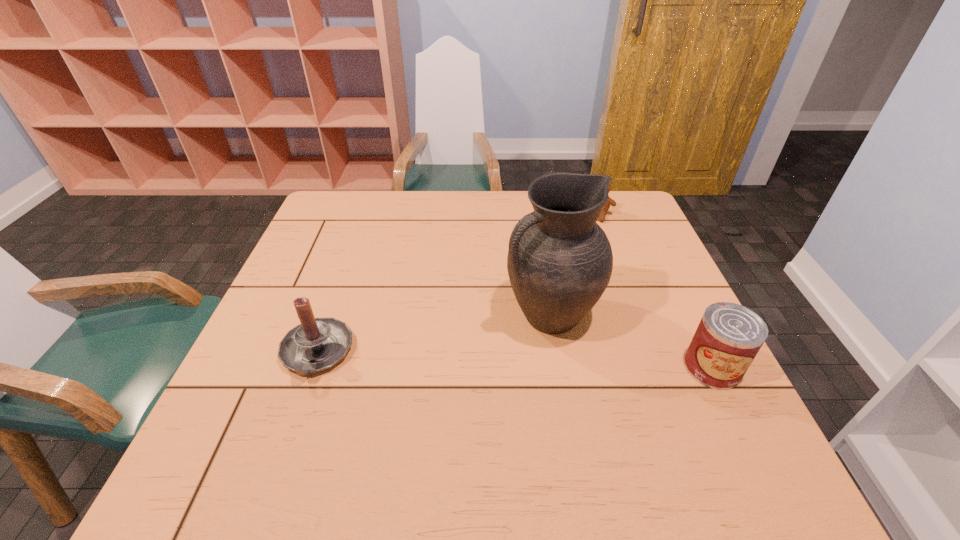
Where is `candle`? candle is located at coordinates (316, 344).

The width and height of the screenshot is (960, 540). Find the location of `the rightmost object`. the rightmost object is located at coordinates (729, 336).

I want to click on the shortest object, so click(x=610, y=201).

Identify the location of the farthest object. The image size is (960, 540). pyautogui.click(x=610, y=201).

Where is `the tallest object`? Image resolution: width=960 pixels, height=540 pixels. the tallest object is located at coordinates (560, 261).

The width and height of the screenshot is (960, 540). I want to click on pitcher, so click(560, 261).

At what (x,y) coordinates should I click in order to perform the action: click on vacant space located 0.100m on the side of the candle with the handle loop. Please return your answer as a coordinate pair (x, y). The height and width of the screenshot is (540, 960). Looking at the image, I should click on (289, 431).

Image resolution: width=960 pixels, height=540 pixels. Identify the location of vacant space situated 0.050m on the front of the rightmost object. (733, 411).

The image size is (960, 540). I want to click on free location located 0.090m on the front-facing side of the farthest object, so click(586, 238).

Identify the location of free spot located on the front-facing side of the farthest object. (555, 294).